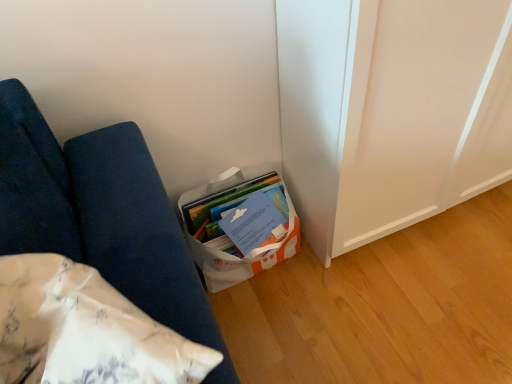
Question: Should I look upward or downward to see white fabric cushion at lower left?

Choices:
 (A) up
 (B) down

Answer: (B)

Question: From the image's perspective, is white fabric cushion at lower left on top of white paper bag at lower center?

Choices:
 (A) yes
 (B) no

Answer: (B)

Question: Is the position of white fabric cushion at lower left more distant than that of white paper bag at lower center?

Choices:
 (A) no
 (B) yes

Answer: (A)

Question: Is white fabric cushion at lower left looking in the opposite direction of white paper bag at lower center?

Choices:
 (A) no
 (B) yes

Answer: (A)

Question: Can you confirm if white fabric cushion at lower left is thinner than white paper bag at lower center?

Choices:
 (A) no
 (B) yes

Answer: (B)

Question: Is white fabric cushion at lower left closer to camera compared to white paper bag at lower center?

Choices:
 (A) yes
 (B) no

Answer: (A)

Question: Are white fabric cushion at lower left and white paper bag at lower center located far from each other?

Choices:
 (A) yes
 (B) no

Answer: (B)

Question: From the image's perspective, is white paper bag at lower center over white fabric cushion at lower left?

Choices:
 (A) no
 (B) yes

Answer: (B)

Question: Considering the relative sizes of white paper bag at lower center and white fabric cushion at lower left in the image provided, is white paper bag at lower center smaller than white fabric cushion at lower left?

Choices:
 (A) yes
 (B) no

Answer: (A)

Question: Are white paper bag at lower center and white fabric cushion at lower left making contact?

Choices:
 (A) no
 (B) yes

Answer: (A)

Question: Can you confirm if white paper bag at lower center is positioned to the left of white fabric cushion at lower left?

Choices:
 (A) no
 (B) yes

Answer: (A)

Question: Considering the relative sizes of white paper bag at lower center and white fabric cushion at lower left in the image provided, is white paper bag at lower center wider than white fabric cushion at lower left?

Choices:
 (A) yes
 (B) no

Answer: (A)

Question: Is white paper bag at lower center not inside white fabric cushion at lower left?

Choices:
 (A) no
 (B) yes

Answer: (B)

Question: Is white fabric cushion at lower left wider or thinner than white paper bag at lower center?

Choices:
 (A) thin
 (B) wide

Answer: (A)